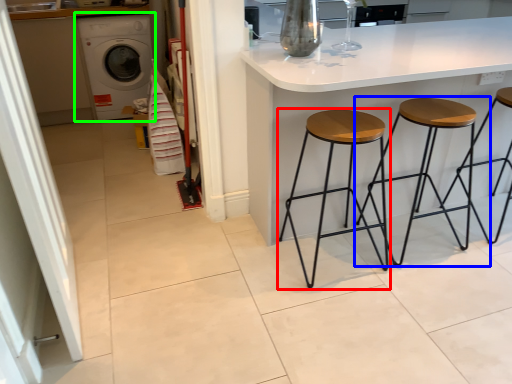
Question: Considering the real-world distances, which object is farthest from stool (highlighted by a red box)? stool (highlighted by a blue box) or washing machine (highlighted by a green box)?

Choices:
 (A) stool
 (B) washing machine

Answer: (B)